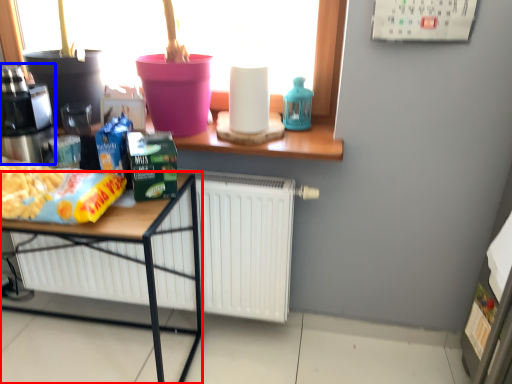
Question: Which point is further to the camera, desk (highlighted by a red box) or coffee machine (highlighted by a blue box)?

Choices:
 (A) desk
 (B) coffee machine

Answer: (B)